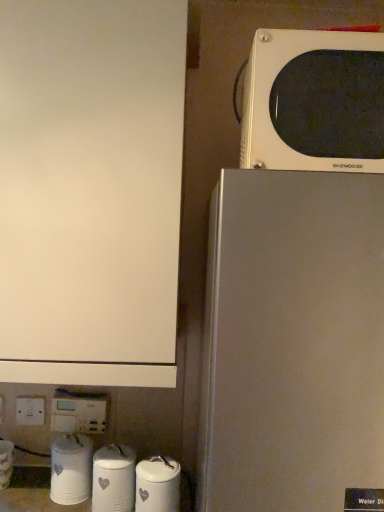
Question: Is the position of white glossy canister at lower center, which is the 4th appliance in left-to-right order, more distant than that of white glossy canister at lower center, the third appliance in the left-to-right sequence?

Choices:
 (A) yes
 (B) no

Answer: (B)

Question: Is white glossy canister at lower center, which is the 4th appliance in left-to-right order, oriented towards white glossy canister at lower center, which is the second appliance from right to left?

Choices:
 (A) yes
 (B) no

Answer: (B)

Question: Does white glossy canister at lower center, the 1th appliance viewed from the right, have a greater height compared to white glossy canister at lower center, which is the second appliance from right to left?

Choices:
 (A) yes
 (B) no

Answer: (A)

Question: Is white glossy canister at lower center, which is the 4th appliance in left-to-right order, looking in the opposite direction of white glossy canister at lower center, which is the second appliance from right to left?

Choices:
 (A) no
 (B) yes

Answer: (A)

Question: Is white glossy canister at lower center, the third appliance in the left-to-right sequence, located within white glossy canister at lower center, which is the 4th appliance in left-to-right order?

Choices:
 (A) yes
 (B) no

Answer: (B)

Question: In terms of height, does white glossy canisters at lower left, the second appliance from the left, look taller or shorter compared to white plastic electric outlet at lower left?

Choices:
 (A) short
 (B) tall

Answer: (B)

Question: Is white glossy canisters at lower left, acting as the third appliance starting from the right, inside the boundaries of white plastic electric outlet at lower left, or outside?

Choices:
 (A) outside
 (B) inside

Answer: (A)

Question: From the image's perspective, is white glossy canisters at lower left, acting as the third appliance starting from the right, located above or below white plastic electric outlet at lower left?

Choices:
 (A) below
 (B) above

Answer: (A)

Question: Relative to white plastic electric outlet at lower left, is white glossy canisters at lower left, acting as the third appliance starting from the right, in front or behind?

Choices:
 (A) behind
 (B) front

Answer: (B)

Question: Is white glossy canister at lower center, the 1th appliance viewed from the right, wider or thinner than white glossy water filter at lower left, the first appliance positioned from the left?

Choices:
 (A) wide
 (B) thin

Answer: (B)

Question: From a real-world perspective, is white glossy canister at lower center, which is the 4th appliance in left-to-right order, above or below white glossy water filter at lower left, the first appliance positioned from the left?

Choices:
 (A) below
 (B) above

Answer: (B)

Question: Relative to white glossy water filter at lower left, the first appliance positioned from the left, is white glossy canister at lower center, which is the 4th appliance in left-to-right order, in front or behind?

Choices:
 (A) front
 (B) behind

Answer: (A)

Question: Is white glossy canister at lower center, which is the 4th appliance in left-to-right order, inside or outside of white glossy water filter at lower left, the first appliance positioned from the left?

Choices:
 (A) outside
 (B) inside

Answer: (A)

Question: Is white glossy canister at lower center, the third appliance in the left-to-right sequence, inside or outside of white matte cabinet at upper left?

Choices:
 (A) outside
 (B) inside

Answer: (A)

Question: In the image, is white glossy canister at lower center, which is the second appliance from right to left, on the left side or the right side of white matte cabinet at upper left?

Choices:
 (A) left
 (B) right

Answer: (B)